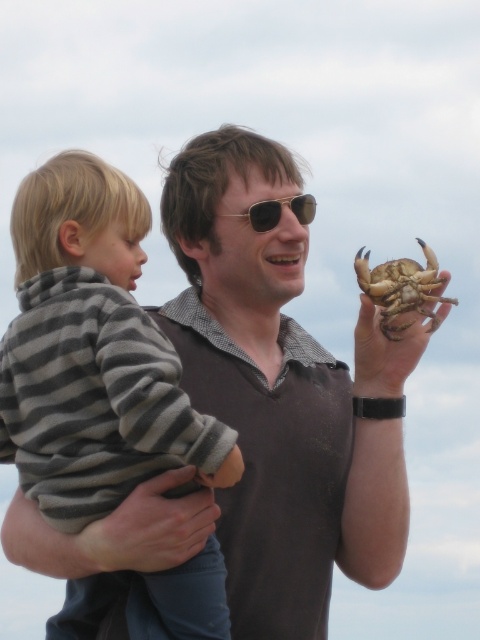
Looking at this image, you are a photographer trying to capture a candid shot of the gold metallic sunglasses at center and the striped fleece sweater at left. Based on their positions, which object should you focus on first to ensure both are in frame without moving the camera?

The striped fleece sweater at left is to the left of the gold metallic sunglasses at center, so you should focus on the gold metallic sunglasses at center first to ensure both are in frame without moving the camera.

You are a photographer trying to capture a clear photo of the striped fleece sweater at left and the brown hard shell crab at upper right. Which object should you focus on first if you want to ensure both are in focus without adjusting the camera settings?

The striped fleece sweater at left has a greater height compared to the brown hard shell crab at upper right. Therefore, focusing on the striped fleece sweater at left first will ensure both objects are in focus since it is taller and likely closer to the camera.

You are a photographer trying to capture a closeup of the gold metallic sunglasses at center while also including the brown textured crab claw at upper right in the frame. Based on their sizes, which object should you focus on to ensure both are in the shot without cropping?

The gold metallic sunglasses at center is smaller than the brown textured crab claw at upper right, so focusing on the sunglasses will allow both objects to fit in the frame since the crab claw is larger and can be positioned alongside without cropping.